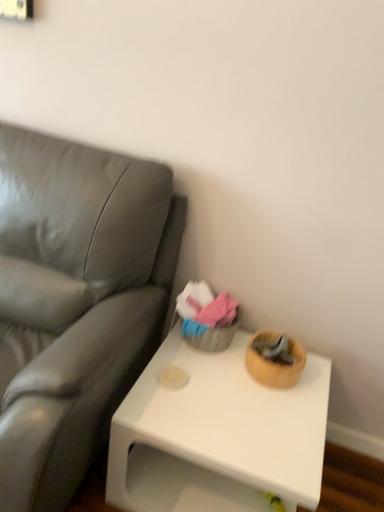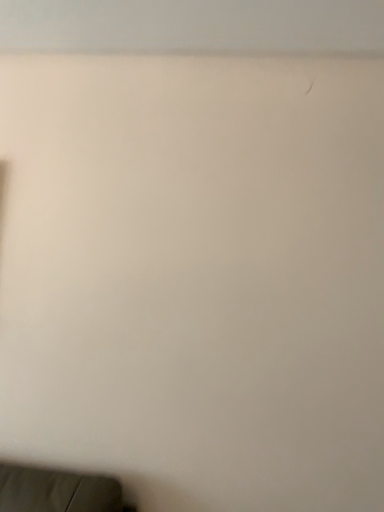
Question: How did the camera likely rotate when shooting the video?

Choices:
 (A) rotated right
 (B) rotated left

Answer: (A)